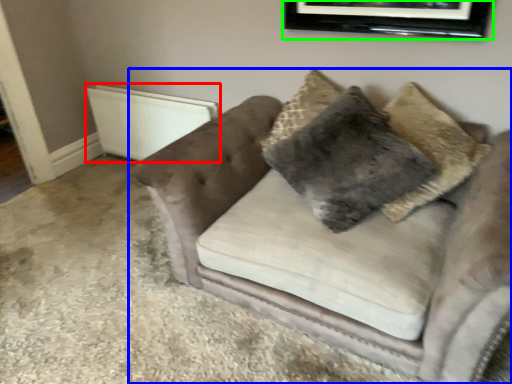
Question: Which object is the closest to the radiator (highlighted by a red box)? Choose among these: studio couch (highlighted by a blue box) or picture frame (highlighted by a green box).

Choices:
 (A) studio couch
 (B) picture frame

Answer: (A)